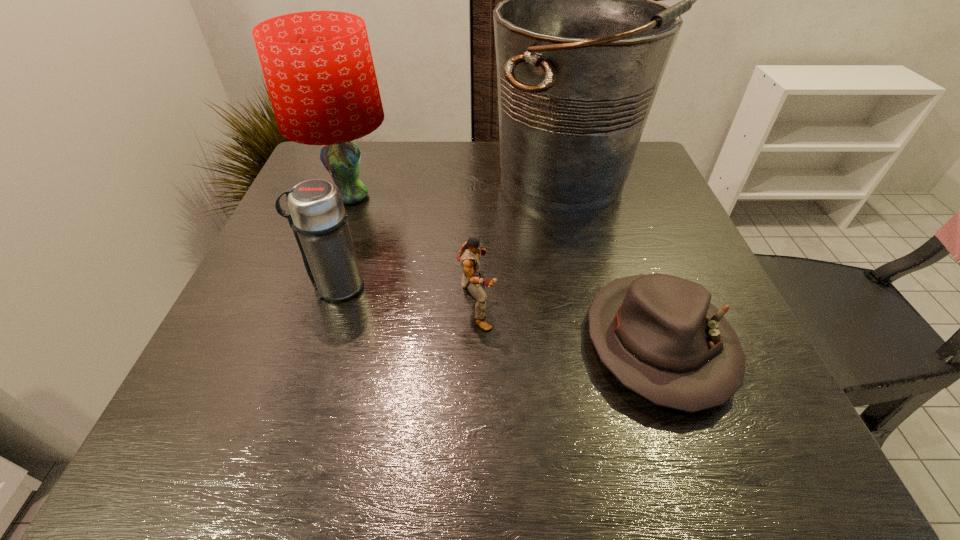
At what (x,y) coordinates should I click in order to perform the action: click on vacant space located on the front-facing side of the puncher. Please return your answer as a coordinate pair (x, y). The image size is (960, 540). Looking at the image, I should click on (570, 306).

Identify the location of bucket that is at the far edge. The width and height of the screenshot is (960, 540). (581, 42).

Where is `lampshade located in the far edge section of the desktop`? This screenshot has width=960, height=540. lampshade located in the far edge section of the desktop is located at coordinates (318, 67).

Identify the location of object that is at the near edge. This screenshot has width=960, height=540. (659, 335).

Where is `lampshade that is at the left edge`? Image resolution: width=960 pixels, height=540 pixels. lampshade that is at the left edge is located at coordinates (318, 67).

Locate an element on the screen. thermos bottle present at the left edge is located at coordinates [x=316, y=214].

Image resolution: width=960 pixels, height=540 pixels. Identify the location of bucket located in the right edge section of the desktop. (581, 42).

At what (x,y) coordinates should I click in order to perform the action: click on hat at the right edge. Please return your answer as a coordinate pair (x, y). Looking at the image, I should click on (659, 335).

In order to click on object that is at the far left corner in this screenshot , I will do `click(318, 67)`.

Locate an element on the screen. The image size is (960, 540). object that is at the far right corner is located at coordinates coord(581,42).